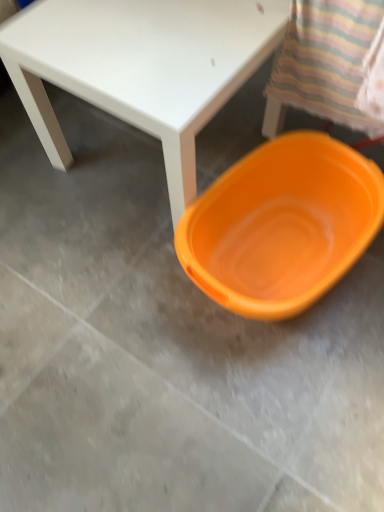
The height and width of the screenshot is (512, 384). Describe the element at coordinates (141, 67) in the screenshot. I see `matte white table at center` at that location.

The image size is (384, 512). I want to click on matte white table at center, so click(x=141, y=67).

What are the coordinates of `orange plastic basin at lower right` in the screenshot? It's located at (282, 225).

The height and width of the screenshot is (512, 384). What do you see at coordinates (282, 225) in the screenshot?
I see `orange plastic basin at lower right` at bounding box center [282, 225].

Where is `matte white table at center`? Image resolution: width=384 pixels, height=512 pixels. matte white table at center is located at coordinates (141, 67).

Would you say orange plastic basin at lower right is to the left or to the right of matte white table at center in the picture?

Based on their positions, orange plastic basin at lower right is located to the right of matte white table at center.

Is orange plastic basin at lower right behind matte white table at center?

Yes, orange plastic basin at lower right is further from the camera.

Considering the points (238, 292) and (131, 111), which point is in front, point (238, 292) or point (131, 111)?

The point (131, 111) is more forward.

From the image's perspective, is orange plastic basin at lower right located above matte white table at center?

No.

From a real-world perspective, is orange plastic basin at lower right above or below matte white table at center?

From a real-world perspective, orange plastic basin at lower right is physically below matte white table at center.

Between orange plastic basin at lower right and matte white table at center, which one has larger width?

Wider between the two is orange plastic basin at lower right.

In terms of height, does orange plastic basin at lower right look taller or shorter compared to matte white table at center?

orange plastic basin at lower right is shorter than matte white table at center.

Is orange plastic basin at lower right smaller than matte white table at center?

Indeed, orange plastic basin at lower right has a smaller size compared to matte white table at center.

Would you say orange plastic basin at lower right contains matte white table at center?

No, matte white table at center is not inside orange plastic basin at lower right.

Are orange plastic basin at lower right and matte white table at center far apart?

They are positioned close to each other.

Is matte white table at center at the back of orange plastic basin at lower right?

No.

Can you tell me how much orange plastic basin at lower right and matte white table at center differ in facing direction?

They differ by 0.000408 degrees in their facing directions.

At what (x,y) coordinates should I click in order to perform the action: click on plate on the right of the matte white table at center. Please return your answer as a coordinate pair (x, y). The width and height of the screenshot is (384, 512). Looking at the image, I should click on (282, 225).

Can you confirm if matte white table at center is positioned to the right of orange plastic basin at lower right?

No.

Is the position of matte white table at center more distant than that of orange plastic basin at lower right?

No.

Does point (256, 37) appear closer or farther from the camera than point (360, 212)?

Clearly, point (256, 37) is closer to the camera than point (360, 212).

From the image's perspective, is matte white table at center located above or below orange plastic basin at lower right?

matte white table at center is above orange plastic basin at lower right.

From a real-world perspective, which is physically above, matte white table at center or orange plastic basin at lower right?

matte white table at center.

Which object is wider, matte white table at center or orange plastic basin at lower right?

orange plastic basin at lower right.

In terms of height, does matte white table at center look taller or shorter compared to orange plastic basin at lower right?

matte white table at center is taller than orange plastic basin at lower right.

Which of these two, matte white table at center or orange plastic basin at lower right, is bigger?

matte white table at center is bigger.

Would you say matte white table at center is outside orange plastic basin at lower right?

Yes, matte white table at center is located beyond the bounds of orange plastic basin at lower right.

Is matte white table at center next to orange plastic basin at lower right and touching it?

There is a gap between matte white table at center and orange plastic basin at lower right.

Could you tell me if matte white table at center is facing orange plastic basin at lower right?

No, matte white table at center does not turn towards orange plastic basin at lower right.

Can you tell me how much matte white table at center and orange plastic basin at lower right differ in facing direction?

The facing directions of matte white table at center and orange plastic basin at lower right are 0.000408 degrees apart.

This screenshot has width=384, height=512. Identify the location of plate behind the matte white table at center. (282, 225).

The height and width of the screenshot is (512, 384). I want to click on table located on the left of orange plastic basin at lower right, so click(141, 67).

Identify the location of plate located behind the matte white table at center. The image size is (384, 512). (282, 225).